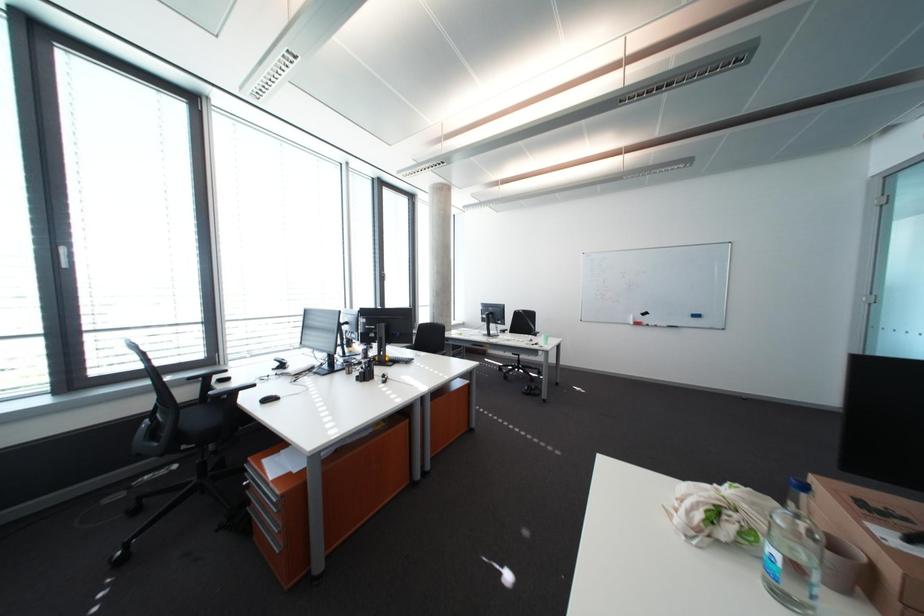
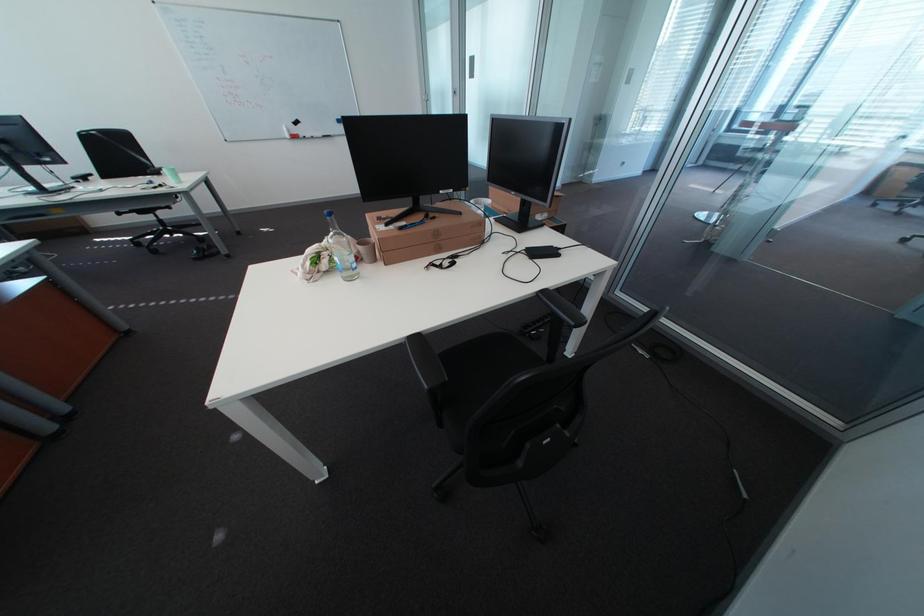
In the scene shown: Based on the continuous images, in which direction is the camera rotating?

The rotation direction of the camera is right-down.